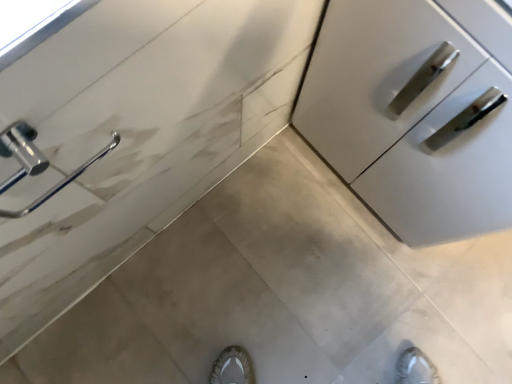
Question: Is the depth of chrome/metallic door handle at left less than that of satin white cabinet at right?

Choices:
 (A) yes
 (B) no

Answer: (A)

Question: From a real-world perspective, is chrome/metallic door handle at left on satin white cabinet at right?

Choices:
 (A) yes
 (B) no

Answer: (A)

Question: Could you tell me if chrome/metallic door handle at left is facing satin white cabinet at right?

Choices:
 (A) no
 (B) yes

Answer: (A)

Question: Is chrome/metallic door handle at left with satin white cabinet at right?

Choices:
 (A) yes
 (B) no

Answer: (B)

Question: Is satin white cabinet at right located within chrome/metallic door handle at left?

Choices:
 (A) yes
 (B) no

Answer: (B)

Question: Can you confirm if chrome/metallic door handle at left is positioned to the right of satin white cabinet at right?

Choices:
 (A) no
 (B) yes

Answer: (A)

Question: From the image's perspective, is satin white cabinet at right located beneath chrome/metallic door handle at left?

Choices:
 (A) yes
 (B) no

Answer: (B)

Question: Does satin white cabinet at right appear on the right side of chrome/metallic door handle at left?

Choices:
 (A) no
 (B) yes

Answer: (B)

Question: Considering the relative sizes of satin white cabinet at right and chrome/metallic door handle at left in the image provided, is satin white cabinet at right bigger than chrome/metallic door handle at left?

Choices:
 (A) yes
 (B) no

Answer: (A)

Question: From a real-world perspective, is satin white cabinet at right positioned under chrome/metallic door handle at left based on gravity?

Choices:
 (A) no
 (B) yes

Answer: (B)

Question: Is satin white cabinet at right wider than chrome/metallic door handle at left?

Choices:
 (A) yes
 (B) no

Answer: (A)

Question: Is satin white cabinet at right not within chrome/metallic door handle at left?

Choices:
 (A) yes
 (B) no

Answer: (A)

Question: Looking at their shapes, would you say chrome/metallic door handle at left is wider or thinner than satin white cabinet at right?

Choices:
 (A) wide
 (B) thin

Answer: (B)